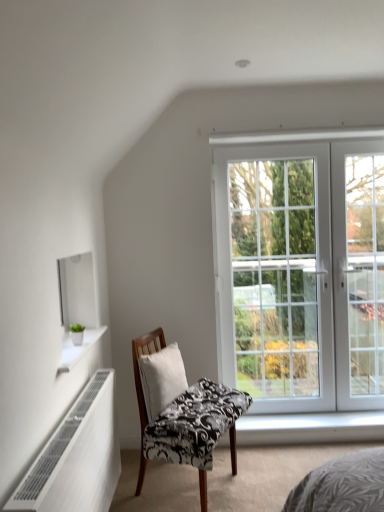
Question: Considering the positions of white glass door at right and white metallic radiator at lower left in the image, is white glass door at right wider or thinner than white metallic radiator at lower left?

Choices:
 (A) wide
 (B) thin

Answer: (B)

Question: From a real-world perspective, is white glass door at right physically located above or below white metallic radiator at lower left?

Choices:
 (A) above
 (B) below

Answer: (A)

Question: Based on their relative distances, which object is farther from the white fabric pillow at center?

Choices:
 (A) white glass door at right
 (B) black and white patterned chair at center
 (C) white glossy shelf at upper left
 (D) white metallic radiator at lower left
 (E) white glass door at right

Answer: (A)

Question: Based on their relative distances, which object is farther from the white glossy shelf at upper left?

Choices:
 (A) white fabric pillow at center
 (B) black and white patterned chair at center
 (C) white glass door at right
 (D) white metallic radiator at lower left
 (E) white glass door at right

Answer: (C)